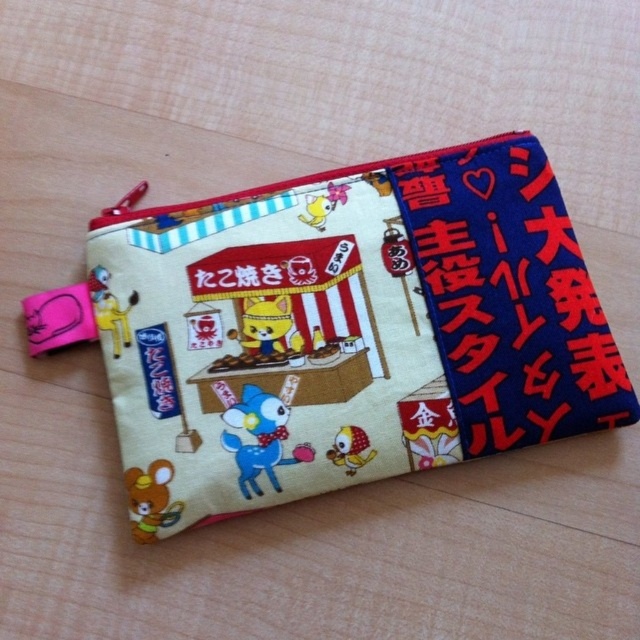
Measure the distance between point (x=572, y=364) and camera.

The distance of point (x=572, y=364) from camera is 4.38 feet.

Does matte fabric pouch at center appear under blue fabric text at right?

Yes.

Measure the distance between point (572,385) and camera.

Point (572,385) is 1.33 meters away from camera.

Find the location of a particular element. This screenshot has height=640, width=640. matte fabric pouch at center is located at coordinates (348, 330).